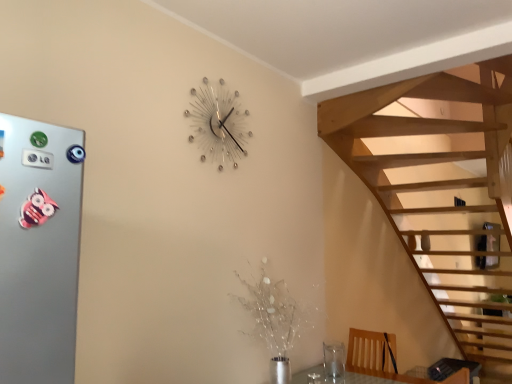
Question: Is transparent glass vase at lower right surrounding silver metallic button at left?

Choices:
 (A) yes
 (B) no

Answer: (B)

Question: Would you consider transparent glass vase at lower right to be distant from silver metallic button at left?

Choices:
 (A) no
 (B) yes

Answer: (B)

Question: From a real-world perspective, is transparent glass vase at lower right on silver metallic button at left?

Choices:
 (A) yes
 (B) no

Answer: (B)

Question: Is transparent glass vase at lower right at the right side of silver metallic button at left?

Choices:
 (A) no
 (B) yes

Answer: (B)

Question: Considering the relative sizes of transparent glass vase at lower right and silver metallic button at left in the image provided, is transparent glass vase at lower right thinner than silver metallic button at left?

Choices:
 (A) yes
 (B) no

Answer: (B)

Question: From the image's perspective, would you say transparent glass vase at lower right is shown under silver metallic button at left?

Choices:
 (A) no
 (B) yes

Answer: (B)

Question: Can you confirm if transparent glass vase at lower right is bigger than metallic silver wall clock at upper center?

Choices:
 (A) yes
 (B) no

Answer: (B)

Question: Could you tell me if transparent glass vase at lower right is turned towards metallic silver wall clock at upper center?

Choices:
 (A) no
 (B) yes

Answer: (A)

Question: From a real-world perspective, is transparent glass vase at lower right positioned under metallic silver wall clock at upper center based on gravity?

Choices:
 (A) yes
 (B) no

Answer: (A)

Question: Is transparent glass vase at lower right with metallic silver wall clock at upper center?

Choices:
 (A) no
 (B) yes

Answer: (A)

Question: Can you confirm if transparent glass vase at lower right is smaller than metallic silver wall clock at upper center?

Choices:
 (A) no
 (B) yes

Answer: (B)

Question: From a real-world perspective, is transparent glass vase at lower right physically above metallic silver wall clock at upper center?

Choices:
 (A) no
 (B) yes

Answer: (A)

Question: Does metallic silver wall clock at upper center have a lesser height compared to transparent glass vase at lower right?

Choices:
 (A) no
 (B) yes

Answer: (A)